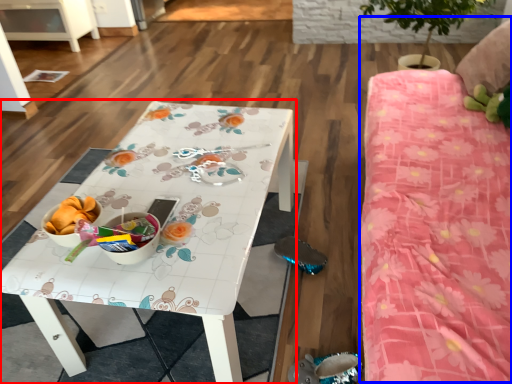
Question: Among these objects, which one is nearest to the camera, table (highlighted by a red box) or bed (highlighted by a blue box)?

Choices:
 (A) table
 (B) bed

Answer: (B)